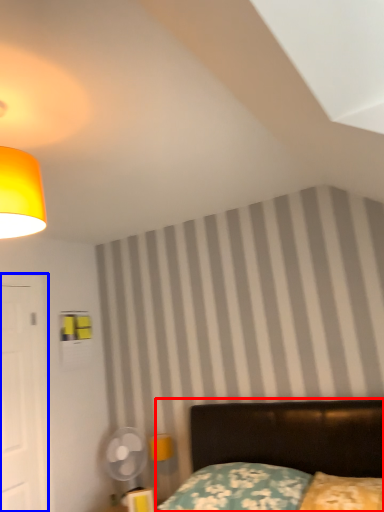
Question: Among these objects, which one is farthest to the camera, bed (highlighted by a red box) or door (highlighted by a blue box)?

Choices:
 (A) bed
 (B) door

Answer: (B)